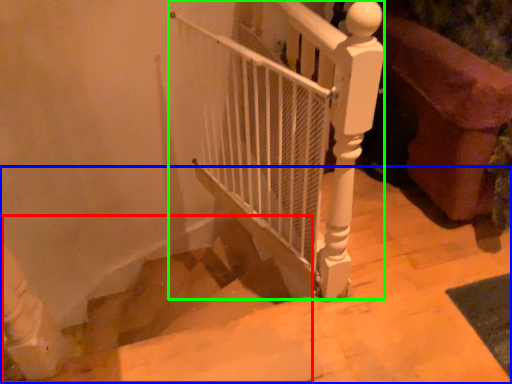
Question: Considering the real-world distances, which object is farthest from stairwell (highlighted by a red box)? stairs (highlighted by a blue box) or fence (highlighted by a green box)?

Choices:
 (A) stairs
 (B) fence

Answer: (B)